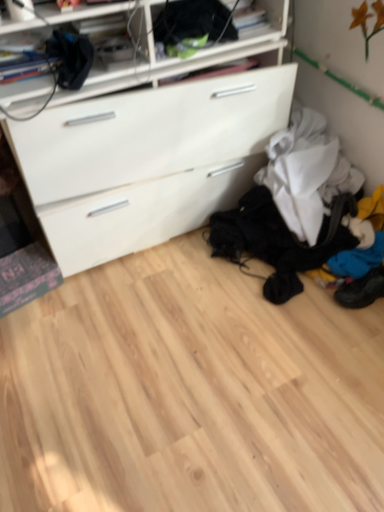
Question: Is blue fabric shoe at lower right located outside black fabric at upper center?

Choices:
 (A) no
 (B) yes

Answer: (B)

Question: From a real-world perspective, is blue fabric shoe at lower right positioned over black fabric at upper center based on gravity?

Choices:
 (A) yes
 (B) no

Answer: (B)

Question: From the image's perspective, is blue fabric shoe at lower right located beneath black fabric at upper center?

Choices:
 (A) no
 (B) yes

Answer: (B)

Question: From a real-world perspective, is blue fabric shoe at lower right positioned under black fabric at upper center based on gravity?

Choices:
 (A) no
 (B) yes

Answer: (B)

Question: Are blue fabric shoe at lower right and black fabric at upper center making contact?

Choices:
 (A) yes
 (B) no

Answer: (B)

Question: Can you confirm if blue fabric shoe at lower right is shorter than black fabric at upper center?

Choices:
 (A) no
 (B) yes

Answer: (B)

Question: Considering the relative sizes of black fabric at upper center and blue fabric shoe at lower right in the image provided, is black fabric at upper center wider than blue fabric shoe at lower right?

Choices:
 (A) yes
 (B) no

Answer: (B)

Question: Is black fabric at upper center taller than blue fabric shoe at lower right?

Choices:
 (A) yes
 (B) no

Answer: (A)

Question: From the image's perspective, is black fabric at upper center on top of blue fabric shoe at lower right?

Choices:
 (A) yes
 (B) no

Answer: (A)

Question: From a real-world perspective, is black fabric at upper center positioned under blue fabric shoe at lower right based on gravity?

Choices:
 (A) no
 (B) yes

Answer: (A)

Question: Considering the relative positions of black fabric at upper center and blue fabric shoe at lower right in the image provided, is black fabric at upper center to the right of blue fabric shoe at lower right from the viewer's perspective?

Choices:
 (A) yes
 (B) no

Answer: (B)

Question: Is black fabric at upper center bigger than blue fabric shoe at lower right?

Choices:
 (A) yes
 (B) no

Answer: (A)

Question: Considering the positions of black fabric at upper center and blue fabric shoe at lower right in the image, is black fabric at upper center wider or thinner than blue fabric shoe at lower right?

Choices:
 (A) thin
 (B) wide

Answer: (A)